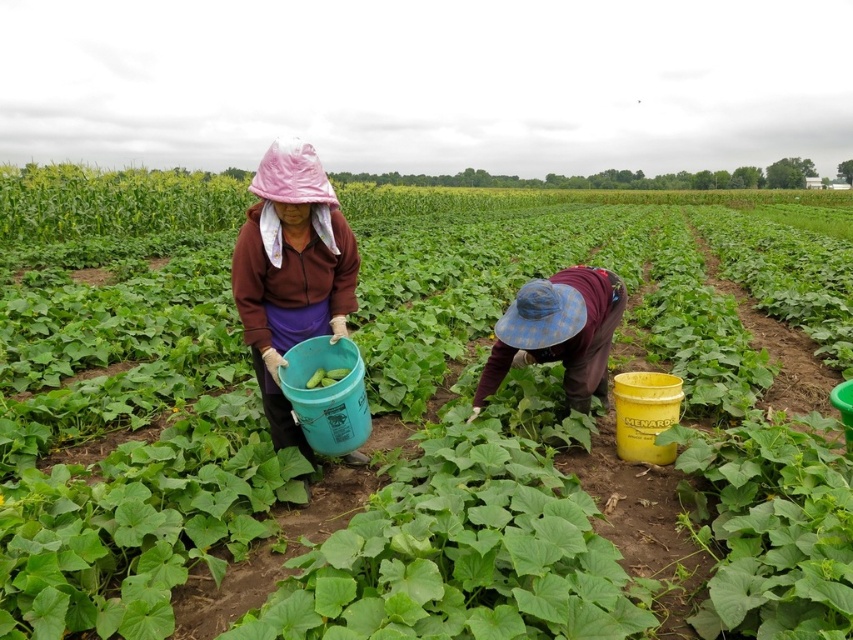
Consider the image. You are standing at the origin point of the image. Which direction should you move to reach the green leafy plant at center?

The green leafy plant at center is located at 2D coordinates point (125,428), so you should move towards the right and slightly downward from your current position at the origin to reach it.

You are a farmer who needs to navigate between the green leafy plant at center and the blue plaid hat at center. Can you pass through the space between them without bending down?

The green leafy plant at center is wider than the blue plaid hat at center, so there might be enough space to pass through without bending down, but it depends on the exact width difference.